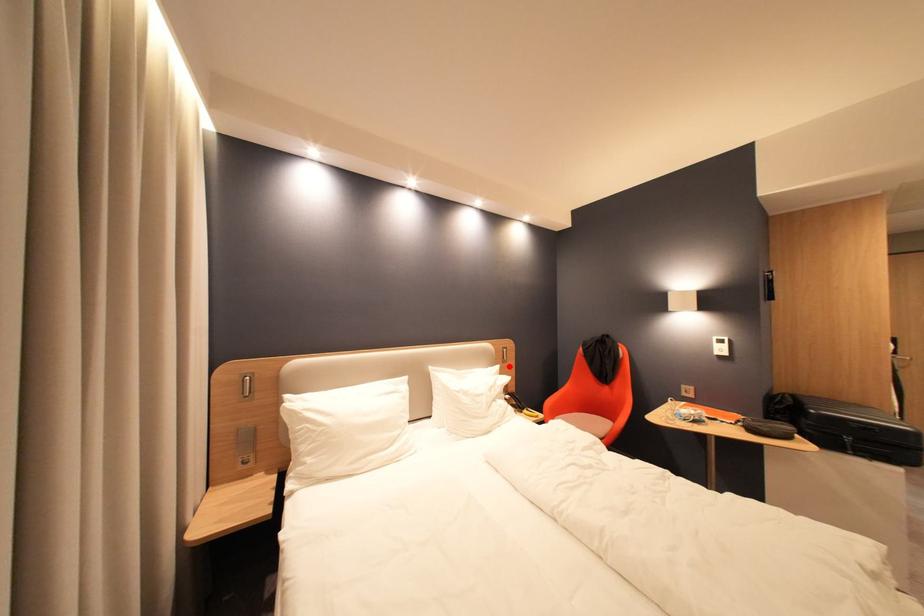
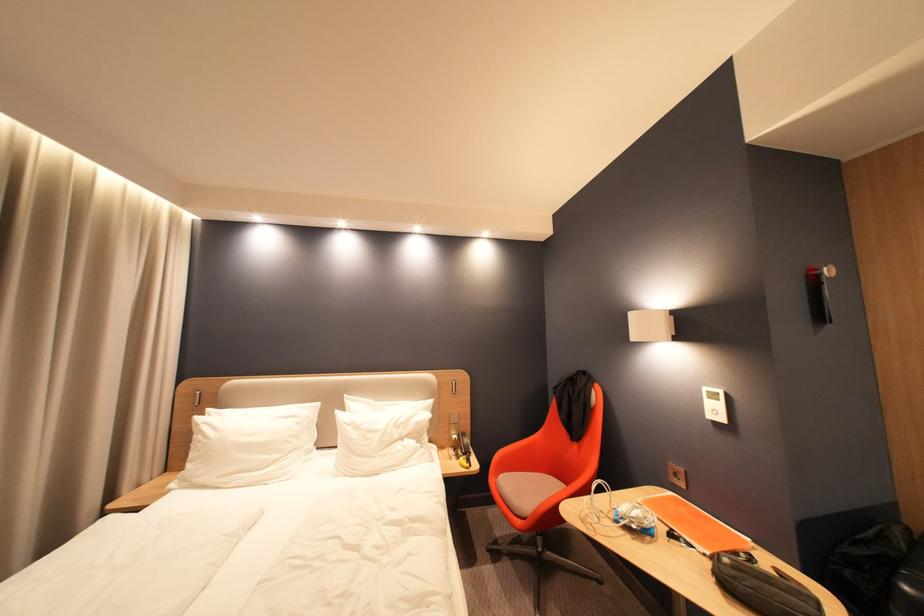
Locate, in the second image, the point that corresponds to the highlighted location in the first image.

(443, 400)